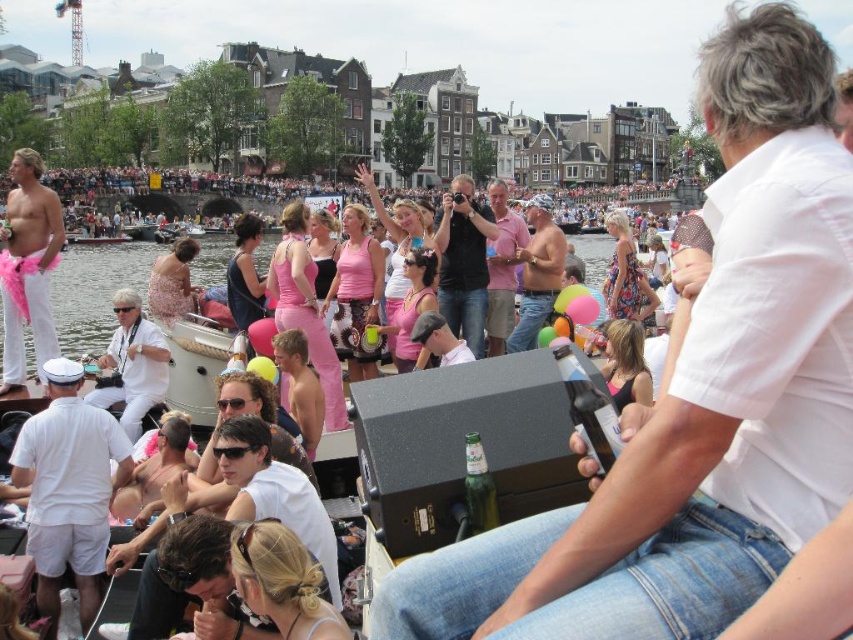
Question: Can you confirm if white matte sailor hat at left is positioned to the right of sparkly gold dress at center?

Choices:
 (A) no
 (B) yes

Answer: (B)

Question: Which object appears farthest from the camera in this image?

Choices:
 (A) pink feather boa at left
 (B) white matte shirt at upper right
 (C) white matte sailor hat at left
 (D) pink fabric crowd at upper center

Answer: (D)

Question: Which object is closer to the camera taking this photo?

Choices:
 (A) pink feather boa at left
 (B) white matte sailor hat at left
 (C) white matte shirt at upper right
 (D) sparkly gold dress at center

Answer: (C)

Question: Can you confirm if white matte shirt at upper right is wider than white matte shirt at center?

Choices:
 (A) yes
 (B) no

Answer: (A)

Question: Does white matte shirt at upper right lie behind white matte shirt at center?

Choices:
 (A) no
 (B) yes

Answer: (A)

Question: Among these objects, which one is farthest from the camera?

Choices:
 (A) pink feather boa at left
 (B) white matte sailor hat at left
 (C) white matte shirt at center
 (D) pink fabric crowd at upper center

Answer: (D)